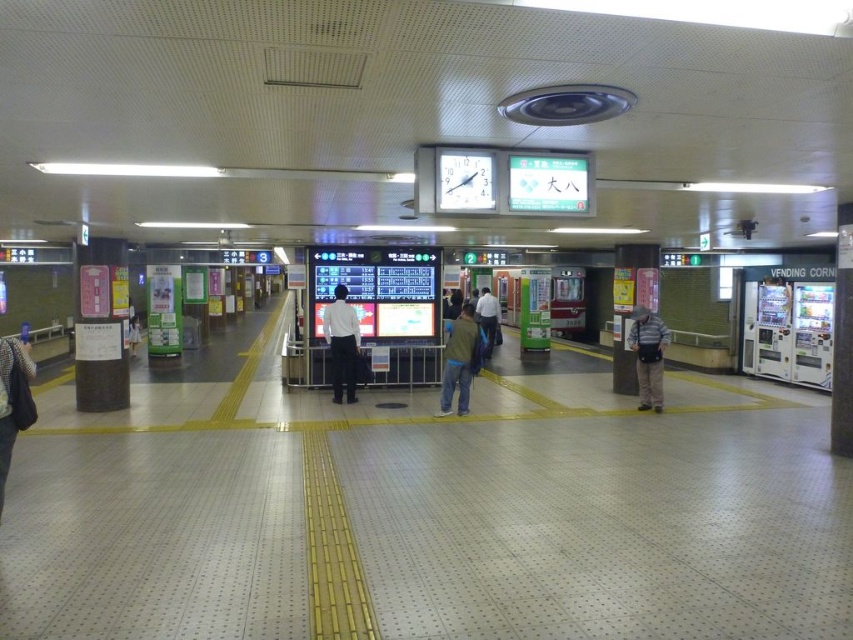
You are standing at the entrance of the train station and want to reach the point marked at coordinates point (640, 320). Given that the average walking speed is 3 feet per second, how many seconds will it take you to reach that point?

The point marked at coordinates point (640, 320) is 32.77 feet away from the camera. At an average walking speed of 3 feet per second, it would take approximately 10.92 seconds to reach the point. Since the question asks for the time in seconds, rounding to the nearest whole number, it would take about 11 seconds.